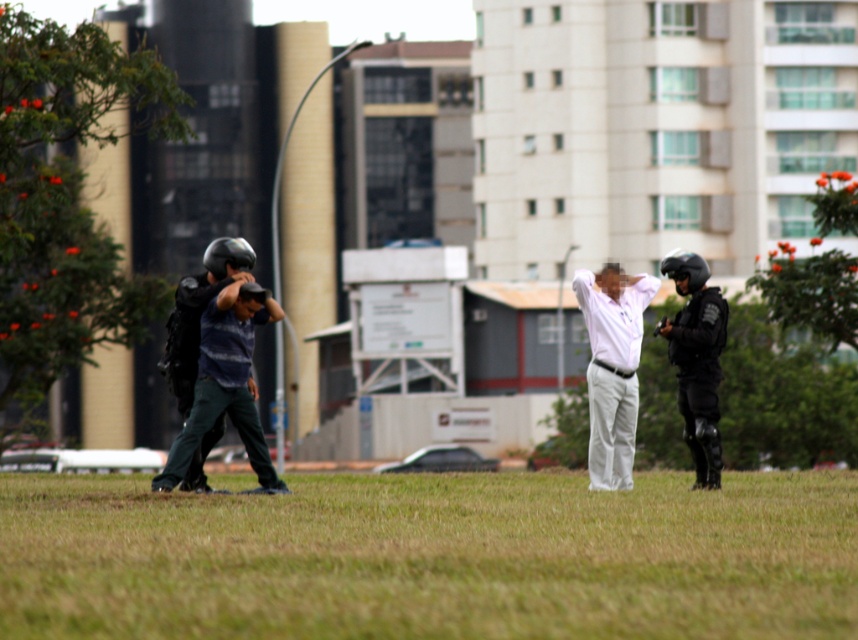
Question: Which point is farther to the camera?

Choices:
 (A) green grass at center
 (B) black matte helmet at center
 (C) black tactical gear at right
 (D) dark blue striped shirt at center

Answer: (B)

Question: Can you confirm if green grass at center is positioned above dark blue striped shirt at center?

Choices:
 (A) no
 (B) yes

Answer: (A)

Question: Which is farther from the green grass at center?

Choices:
 (A) white matte shirt at center
 (B) black matte helmet at center
 (C) dark blue striped shirt at center
 (D) black tactical gear at right

Answer: (B)

Question: Does white matte shirt at center appear on the left side of dark blue striped shirt at center?

Choices:
 (A) no
 (B) yes

Answer: (A)

Question: Which of the following is the farthest from the observer?

Choices:
 (A) (690, 278)
 (B) (583, 276)
 (C) (668, 358)

Answer: (C)

Question: Is green grass at center thinner than dark blue striped shirt at center?

Choices:
 (A) yes
 (B) no

Answer: (A)